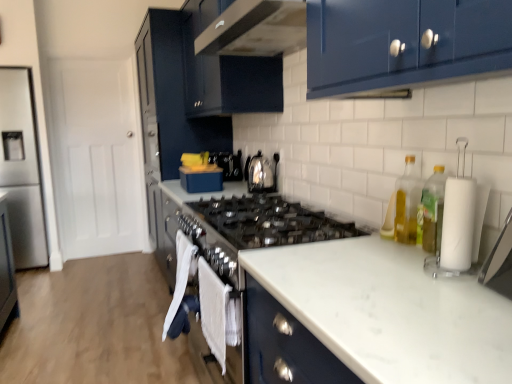
Locate an element on the screen. The image size is (512, 384). free space in front of clear glass bottle at right, the first bottle from the back is located at coordinates (403, 253).